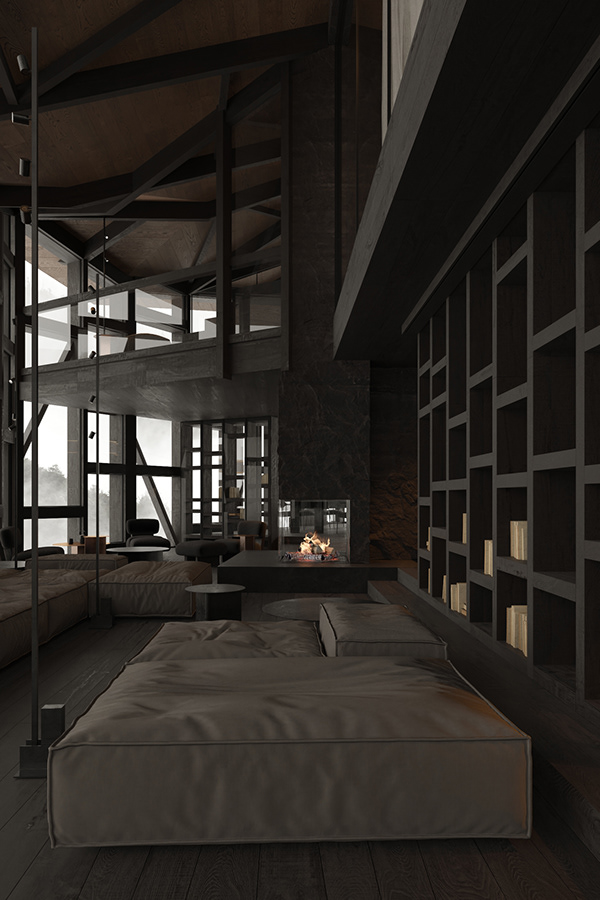
The width and height of the screenshot is (600, 900). In order to click on chimney in this screenshot , I will do click(328, 442).